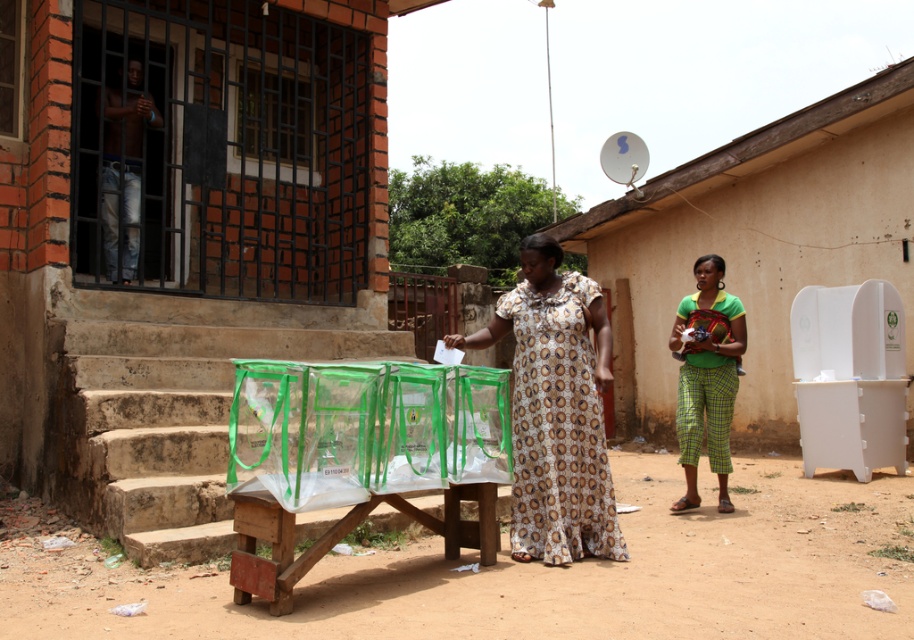
From the picture: You are a delivery person who needs to place a package that requires a signature. The package must be placed exactly 8 meters away from the camera. You see the white plastic ballot box at center. Can you use it as a reference point to ensure the package is placed correctly?

The white plastic ballot box at center and camera are 8.26 meters apart. Since the required distance is 8 meters, placing the package near the white plastic ballot box at center would be approximately correct, within 0.26 meters of the target distance.

You are standing in the residential area shown in the image. You see a person wearing green plaid pants at right and another wearing jeans at left. Which person is positioned more to the right side of the scene?

The green plaid pants at right are to the right of jeans at left, so the person wearing green plaid pants at right is positioned more to the right side of the scene.